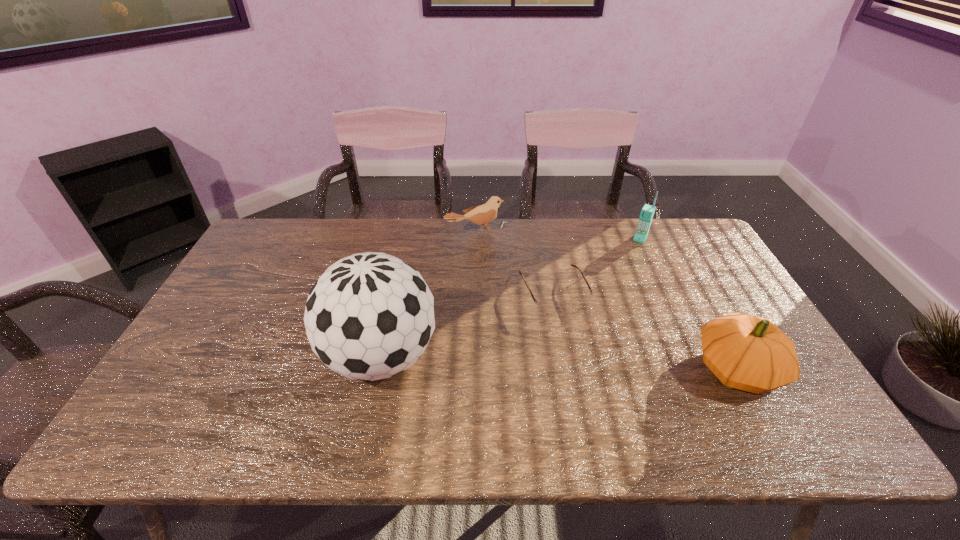
Find the location of a particular element. The height and width of the screenshot is (540, 960). blank region between the tallest object and the shortest object is located at coordinates (468, 325).

Locate an element on the screen. free space between the third object from left to right and the second shortest object is located at coordinates (515, 262).

You are a GUI agent. You are given a task and a screenshot of the screen. Output one action in this format:
    pyautogui.click(x=<x>, y=<y>)
    Task: Click on the free point between the gourd and the soccer ball
    
    Given the screenshot: What is the action you would take?
    pyautogui.click(x=559, y=363)

Locate an element on the screen. free space between the gourd and the tallest object is located at coordinates (559, 363).

Locate an element on the screen. The height and width of the screenshot is (540, 960). empty location between the spectacles and the gourd is located at coordinates (645, 330).

Where is `vacant space that is in between the third object from right to left and the tallest object`? This screenshot has height=540, width=960. vacant space that is in between the third object from right to left and the tallest object is located at coordinates [468, 325].

This screenshot has width=960, height=540. Identify the location of free area in between the gourd and the cellular telephone. (688, 304).

Locate an element on the screen. object that is the third nearest to the fourth tallest object is located at coordinates (647, 212).

Identify which object is the nearest to the cellular telephone. Please provide its 2D coordinates. Your answer should be formatted as a tuple, i.e. [(x, y)], where the tuple contains the x and y coordinates of a point satisfying the conditions above.

[(549, 307)]

Locate an element on the screen. This screenshot has width=960, height=540. blank space that satisfies the following two spatial constraints: 1. on the front side of the bird; 2. on the left side of the cellular telephone is located at coordinates (476, 239).